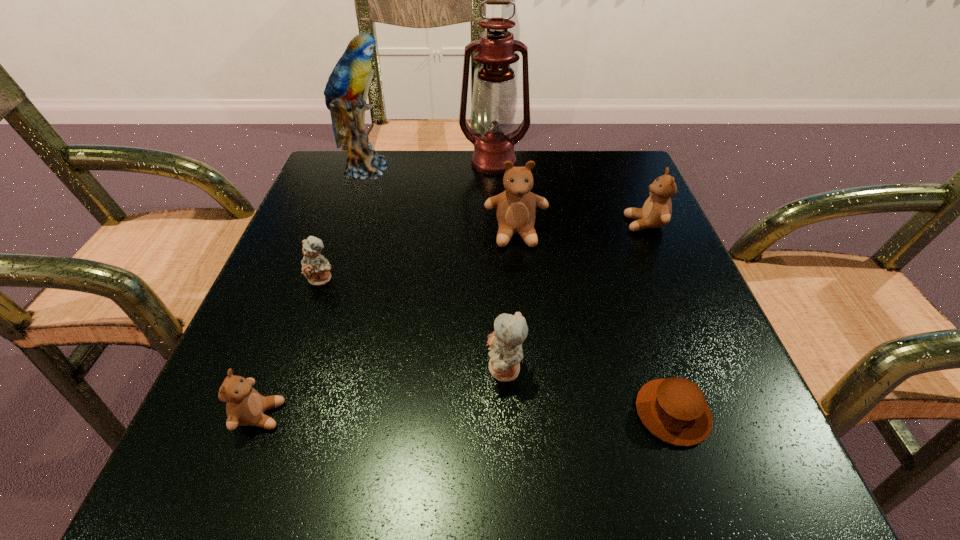
Where is `vacant space that is in between the right blue teddy bear and the tallest teddy bear`? The height and width of the screenshot is (540, 960). vacant space that is in between the right blue teddy bear and the tallest teddy bear is located at coordinates (510, 302).

Identify which object is located as the third nearest to the smallest brown teddy bear. Please provide its 2D coordinates. Your answer should be formatted as a tuple, i.e. [(x, y)], where the tuple contains the x and y coordinates of a point satisfying the conditions above.

[(516, 207)]

Point out which object is positioned as the nearest to the farther blue teddy bear. Please provide its 2D coordinates. Your answer should be formatted as a tuple, i.e. [(x, y)], where the tuple contains the x and y coordinates of a point satisfying the conditions above.

[(245, 406)]

Where is `teddy bear identified as the second closest to the tallest teddy bear`? teddy bear identified as the second closest to the tallest teddy bear is located at coordinates (505, 342).

The height and width of the screenshot is (540, 960). What are the coordinates of `the third closest teddy bear to the parrot` in the screenshot? It's located at coord(656,212).

Locate an element on the screen. This screenshot has height=540, width=960. brown teddy bear that is the third closest to the brown muffin is located at coordinates (245, 406).

Select which brown teddy bear is the closest to the muffin. Please provide its 2D coordinates. Your answer should be formatted as a tuple, i.e. [(x, y)], where the tuple contains the x and y coordinates of a point satisfying the conditions above.

[(516, 207)]

Identify the location of vacant area in the image that satisfies the following two spatial constraints: 1. on the front-facing side of the third nearest teddy bear; 2. on the front-facing side of the nearest teddy bear. Image resolution: width=960 pixels, height=540 pixels. (274, 415).

At what (x,y) coordinates should I click in order to perform the action: click on vacant area in the image that satisfies the following two spatial constraints: 1. on the front side of the muffin; 2. on the front-facing side of the nearest teddy bear. Please return your answer as a coordinate pair (x, y). Looking at the image, I should click on (673, 415).

The height and width of the screenshot is (540, 960). Identify the location of vacant space that satisfies the following two spatial constraints: 1. on the front-facing side of the third tallest object; 2. on the front-facing side of the right blue teddy bear. (528, 370).